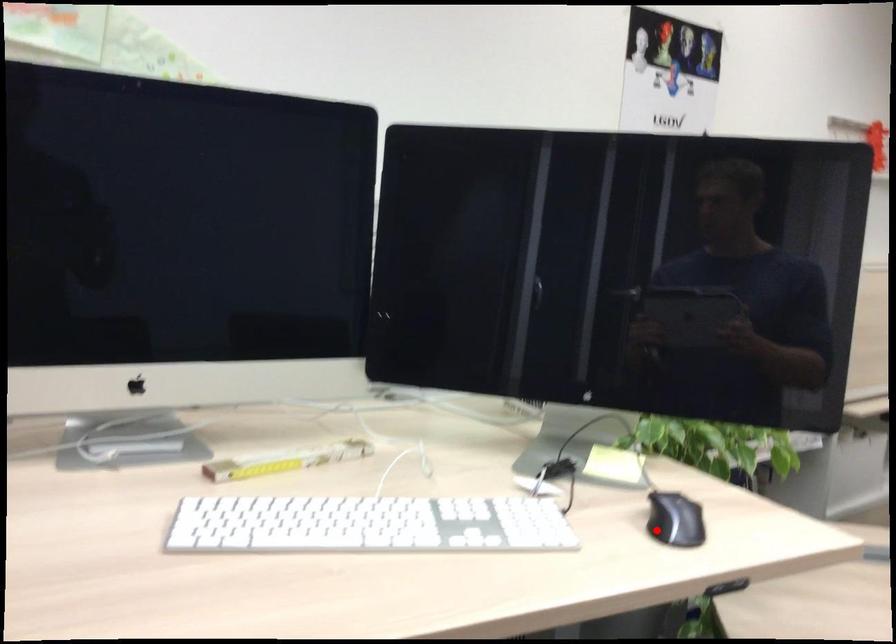
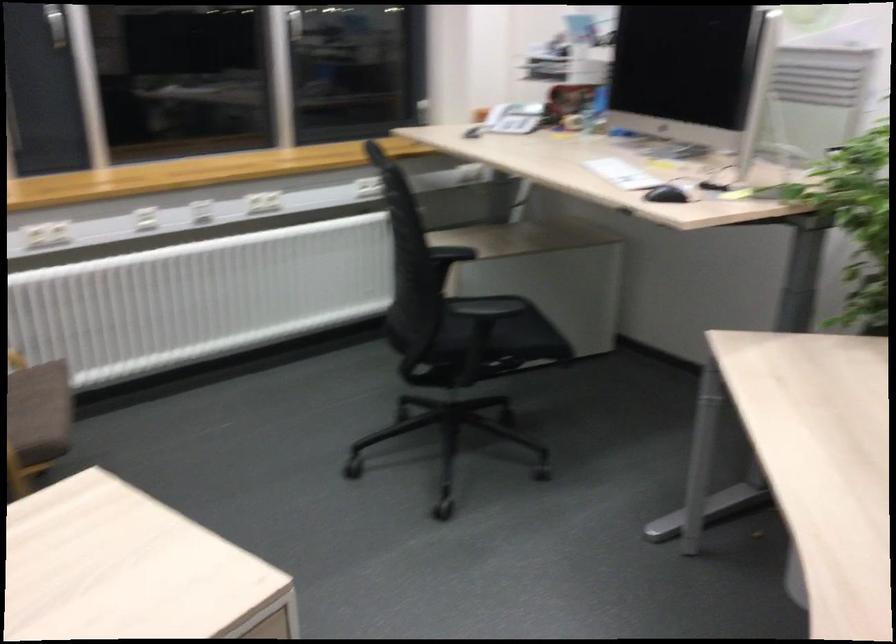
The point at the highlighted location is marked in the first image. Where is the corresponding point in the second image?

(666, 194)